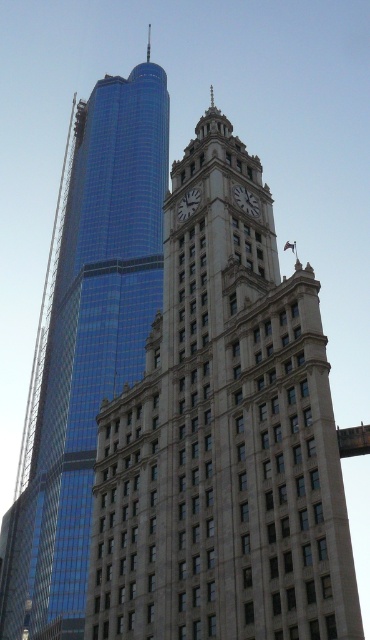
You are standing in front of the shiny glass skyscraper at left and want to take a photo of it. The camera you are using has a maximum focus range of 45 meters. Will the camera be able to focus on the skyscraper?

The distance between the shiny glass skyscraper at left and the camera is 45.13 meters, which exceeds the camera maximum focus range of 45 meters. So the camera will not be able to focus on the skyscraper.

You are an architect analyzing the image. You notice a point at coordinates (89, 346). Which building does this point correspond to?

The point at coordinates (89, 346) corresponds to the shiny glass skyscraper at left.

You are standing in the middle of the street looking at the beige stone clock tower at center and the shiny glass skyscraper at left. Which building is closer to you?

The beige stone clock tower at center is closer to you because it is positioned in front of the shiny glass skyscraper at left.